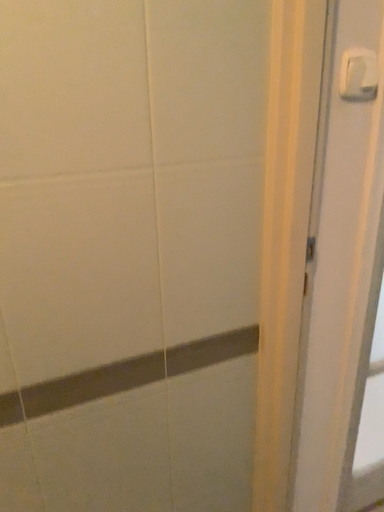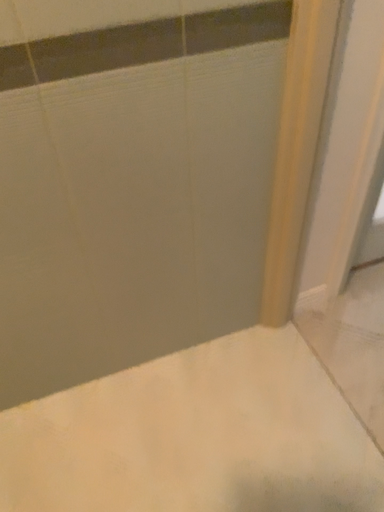
Question: Which way did the camera rotate in the video?

Choices:
 (A) rotated downward
 (B) rotated upward

Answer: (A)